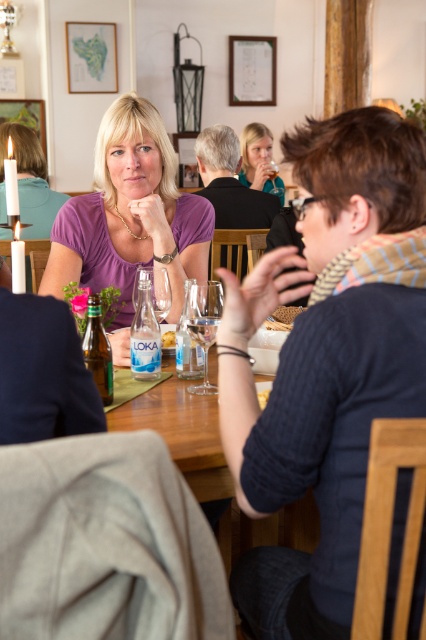
Based on the photo, you are a waiter in the restaurant. You need to place a new wine glass on the table but want to avoid placing it in front of the purple matte shirt at upper center. Where should you place the transparent glass wine glass at center?

You should place the transparent glass wine glass at center behind the purple matte shirt at upper center to avoid blocking its view or space.

You are a server in a restaurant and you need to place a new wine glass at the same position as the existing one at point (259, 161). However, you must ensure that the new glass does not overlap with the existing one. What should you do?

The existing wine glass is located at point (259, 161). To avoid overlapping, place the new glass at a different coordinate, such as slightly to the left or right of the existing one.

You are a server at the restaurant and need to place a new bread basket on the table. The bread basket must be placed behind the existing crumbly bread at table center. Can you place it behind the matte black wine glass at upper center?

The matte black wine glass at upper center is further to the viewer than the crumbly bread at table center. Therefore, placing the bread basket behind the crumbly bread would mean placing it behind the matte black wine glass at upper center as well.